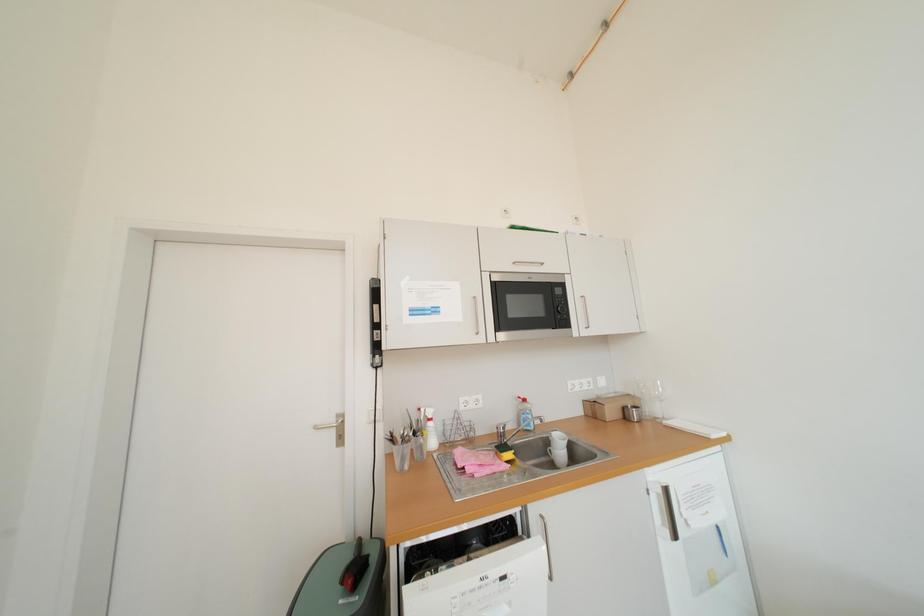
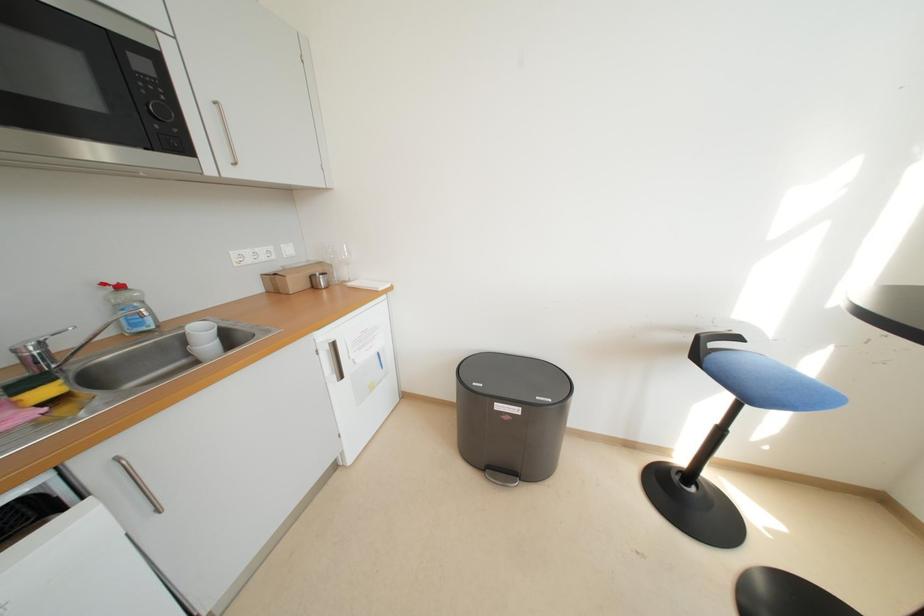
How did the camera likely rotate?

The camera's rotation is toward right-down.